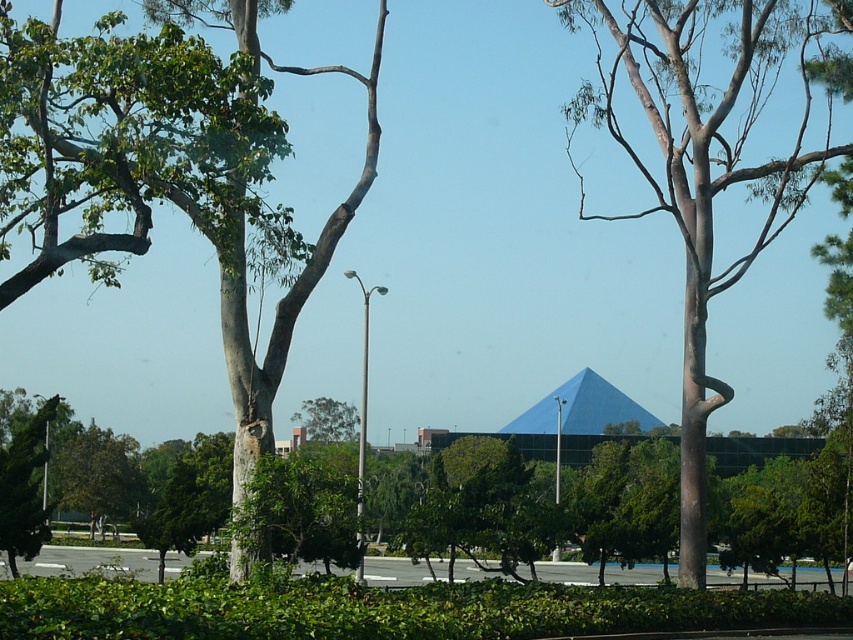
From the picture: You are planning to install a 30 feet long walkway between the green rough bark tree at left and the brown textured tree at center. Based on the scene description, will the walkway fit between them without needing to cut down either tree?

The distance between the green rough bark tree at left and the brown textured tree at center is 33.45 feet, which is longer than the 30 feet walkway. Therefore, the walkway can be installed between them without cutting down either tree.

You are a bird looking for a place to perch. You see the green rough bark tree at left and the brown textured tree at center. Which tree is located directly above the other?

The green rough bark tree at left is positioned under the brown textured tree at center, so the brown textured tree at center is directly above the green rough bark tree at left.